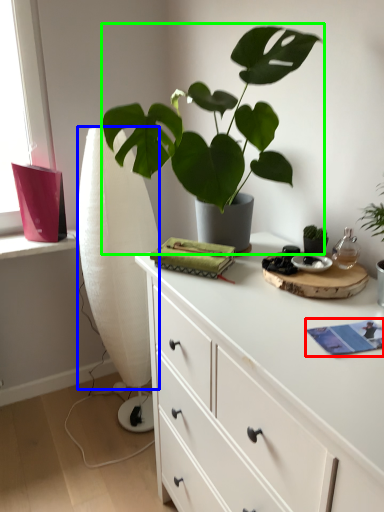
Question: Which is farther away from book (highlighted by a red box)? curtain (highlighted by a blue box) or houseplant (highlighted by a green box)?

Choices:
 (A) curtain
 (B) houseplant

Answer: (A)